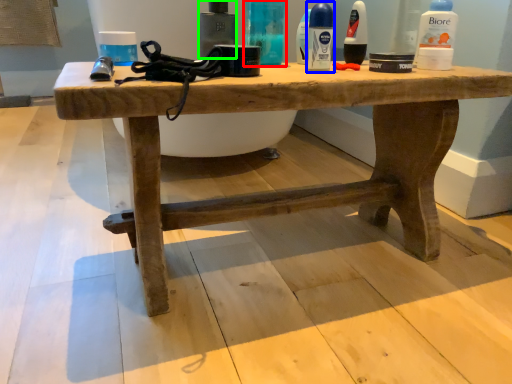
Question: Considering the real-world distances, which object is closest to toiletry (highlighted by a red box)? mouthwash (highlighted by a blue box) or toiletry (highlighted by a green box).

Choices:
 (A) mouthwash
 (B) toiletry

Answer: (B)